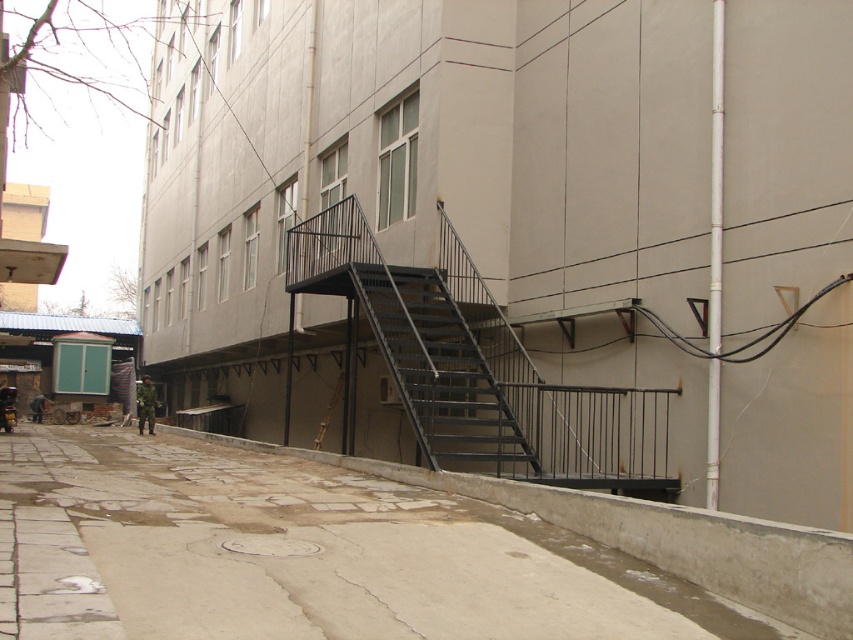
Question: Based on their relative distances, which object is nearer to the black metal stairwell at center?

Choices:
 (A) metallic black staircase at center
 (B) gray concrete alley at lower center

Answer: (B)

Question: Which point is farther to the camera?

Choices:
 (A) [x=241, y=573]
 (B) [x=407, y=352]

Answer: (B)

Question: Can you confirm if gray concrete alley at lower center is wider than black metal stairwell at center?

Choices:
 (A) yes
 (B) no

Answer: (A)

Question: Is gray concrete alley at lower center bigger than black metal stairwell at center?

Choices:
 (A) yes
 (B) no

Answer: (A)

Question: Where is gray concrete alley at lower center located in relation to black metal stairwell at center in the image?

Choices:
 (A) below
 (B) above

Answer: (A)

Question: Which object is farther from the camera taking this photo?

Choices:
 (A) gray concrete alley at lower center
 (B) metallic black staircase at center

Answer: (B)